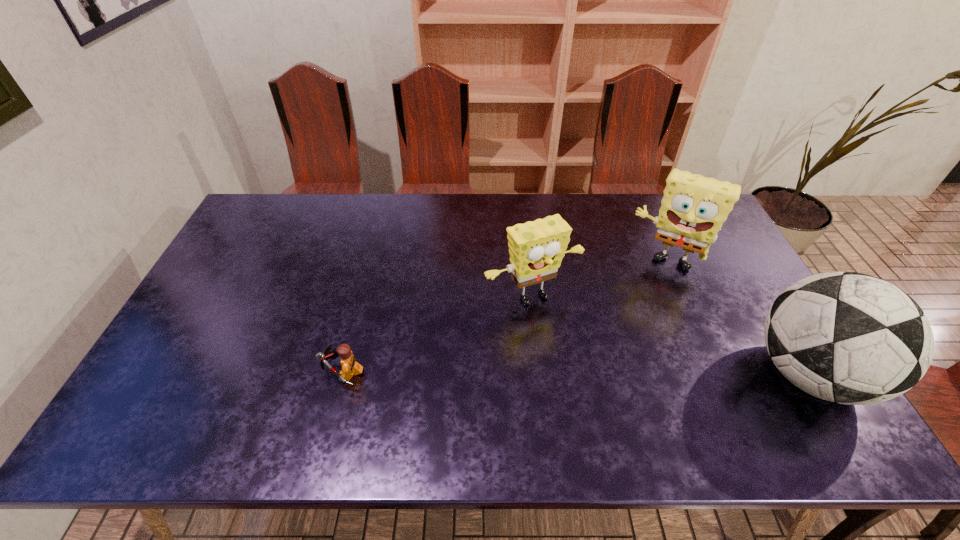
Identify the location of vacant space positioned on the front-facing side of the second farthest object. This screenshot has height=540, width=960. (580, 353).

Identify the location of vacant position located on the front-facing side of the second farthest object. (566, 334).

Where is `free location located 0.200m on the front-facing side of the second farthest object`? Image resolution: width=960 pixels, height=540 pixels. free location located 0.200m on the front-facing side of the second farthest object is located at coordinates (590, 368).

The width and height of the screenshot is (960, 540). What are the coordinates of `free space located 0.360m on the face of the farther sponge` in the screenshot? It's located at (615, 360).

This screenshot has height=540, width=960. What are the coordinates of `vacant space located on the face of the farther sponge` in the screenshot? It's located at (636, 311).

Identify the location of vacant space located on the face of the farther sponge. pos(616,357).

Identify the location of Lego at the near edge. (350, 367).

You are a GUI agent. You are given a task and a screenshot of the screen. Output one action in this format:
    pyautogui.click(x=<x>, y=<y>)
    Task: Click on the soccer ball at the near edge
    
    Given the screenshot: What is the action you would take?
    pyautogui.click(x=846, y=337)

Locate an element on the screen. The image size is (960, 540). soccer ball present at the right edge is located at coordinates (x=846, y=337).

Where is `sponge present at the right edge`? The image size is (960, 540). sponge present at the right edge is located at coordinates (694, 207).